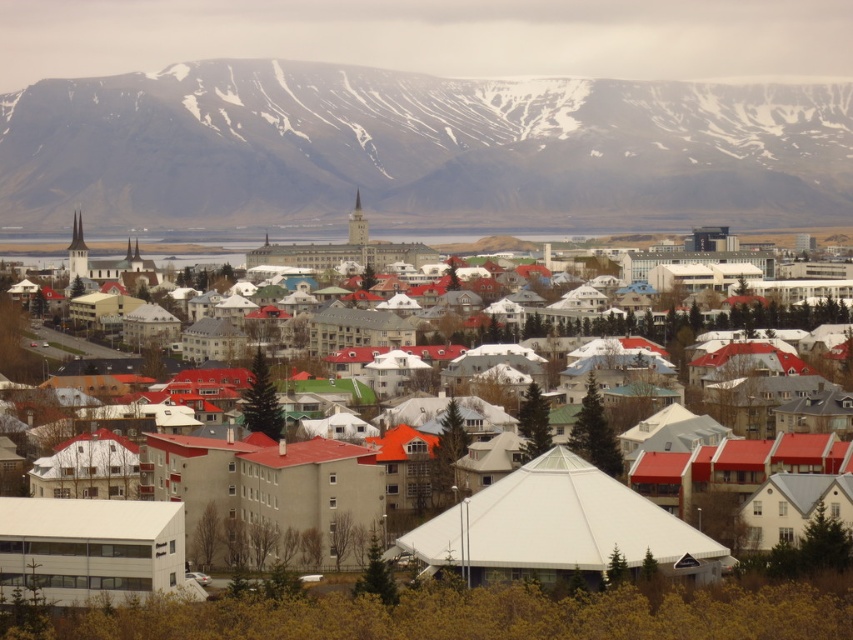
Who is taller, snowy rock formation at upper center or white matte tent at center?

With more height is white matte tent at center.

Who is lower down, snowy rock formation at upper center or white matte tent at center?

Positioned lower is white matte tent at center.

Find the location of a particular element. The height and width of the screenshot is (640, 853). snowy rock formation at upper center is located at coordinates (419, 148).